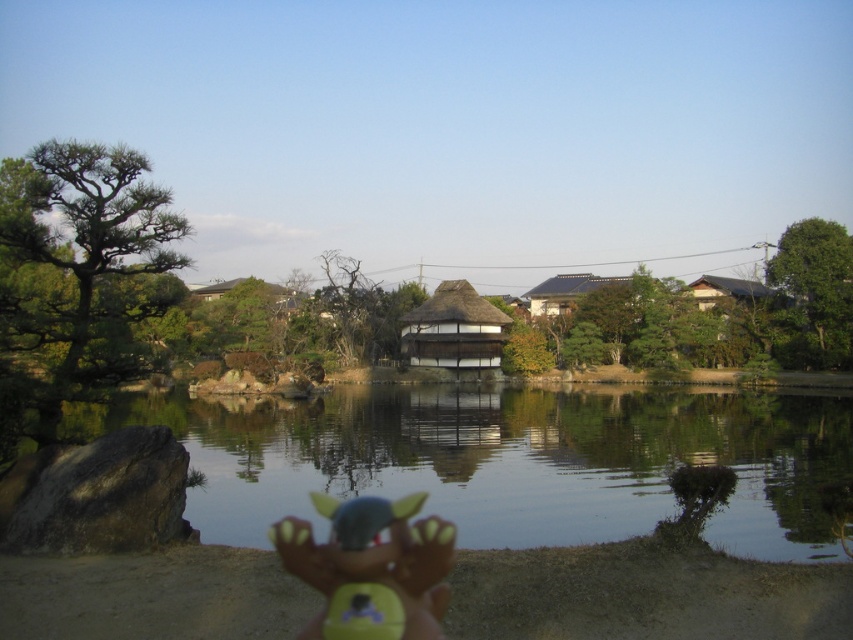
Question: Which object is farther from the camera taking this photo?

Choices:
 (A) plush green toy at lower center
 (B) transparent water at center
 (C) matte wooden hut at center
 (D) brown wooden hut at upper right

Answer: (C)

Question: Does thatched roof hut at center come behind brown wooden hut at upper right?

Choices:
 (A) no
 (B) yes

Answer: (B)

Question: Which object is positioned farthest from the transparent water at center?

Choices:
 (A) plush green toy at lower center
 (B) matte wooden hut at center

Answer: (B)

Question: Can you confirm if transparent water at center is thinner than matte wooden hut at center?

Choices:
 (A) no
 (B) yes

Answer: (B)

Question: Is transparent water at center thinner than thatched roof hut at center?

Choices:
 (A) no
 (B) yes

Answer: (A)

Question: Estimate the real-world distances between objects in this image. Which object is closer to the thatched roof hut at center?

Choices:
 (A) transparent water at center
 (B) brown wooden hut at upper right

Answer: (A)